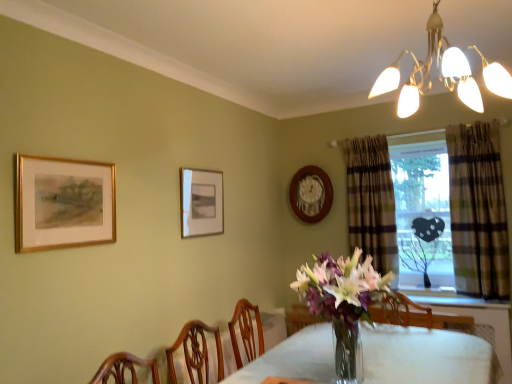
Question: Does point (440, 221) appear closer or farther from the camera than point (440, 365)?

Choices:
 (A) farther
 (B) closer

Answer: (A)

Question: From a real-world perspective, is transparent glass heart at center above or below clear glass table at center?

Choices:
 (A) below
 (B) above

Answer: (B)

Question: Which object is the closest to the plaid fabric curtain at right, arranged as the first curtain when viewed from the front?

Choices:
 (A) wooden clock at upper center, the third picture frame from the front
 (B) matte gold picture frame at center, which appears as the 2th picture frame when viewed from the right
 (C) plaid fabric curtain at right, marked as the first curtain in a left-to-right arrangement
 (D) gold-framed painting at upper left, placed as the third picture frame when sorted from back to front
 (E) transparent glass heart at center

Answer: (E)

Question: Estimate the real-world distances between objects in this image. Which object is closer to the plaid fabric curtain at right, arranged as the first curtain when viewed from the front?

Choices:
 (A) clear glass table at center
 (B) transparent glass heart at center
 (C) matte gold picture frame at center, which appears as the 2th picture frame when viewed from the right
 (D) plaid fabric curtain at right, which ranks as the 1th curtain in back-to-front order
 (E) wooden clock at upper center, the third picture frame from the front

Answer: (B)